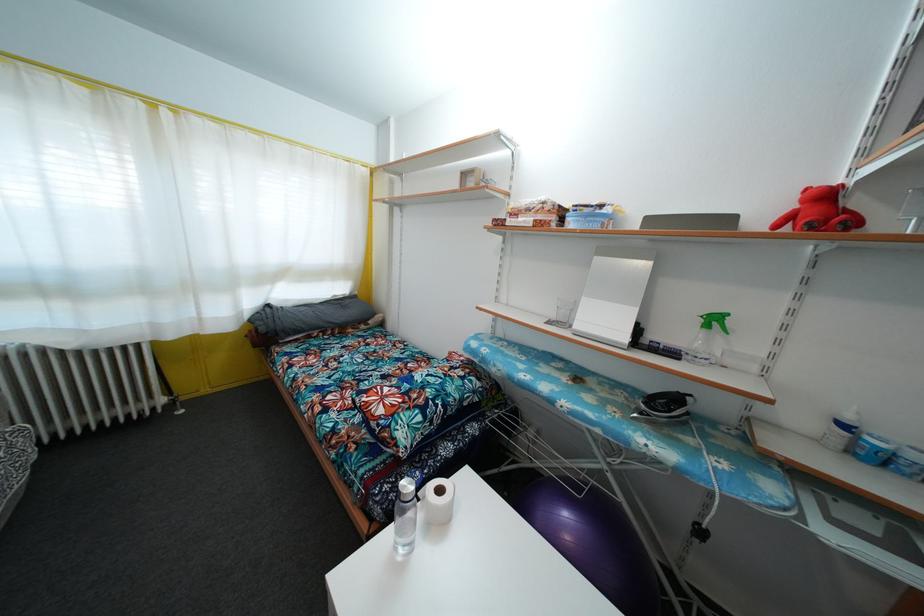
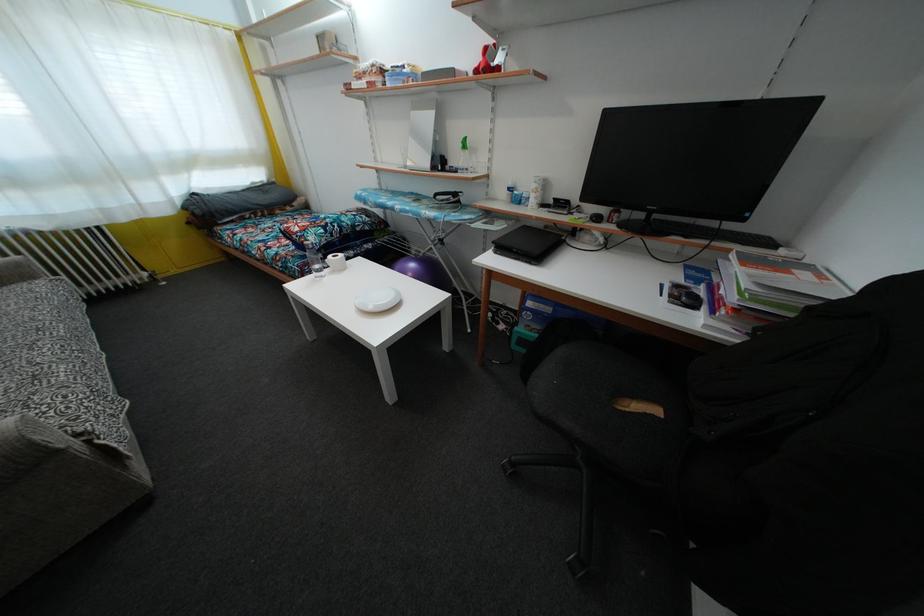
The point at (x=827, y=201) is marked in the first image. Where is the corresponding point in the second image?

(490, 58)